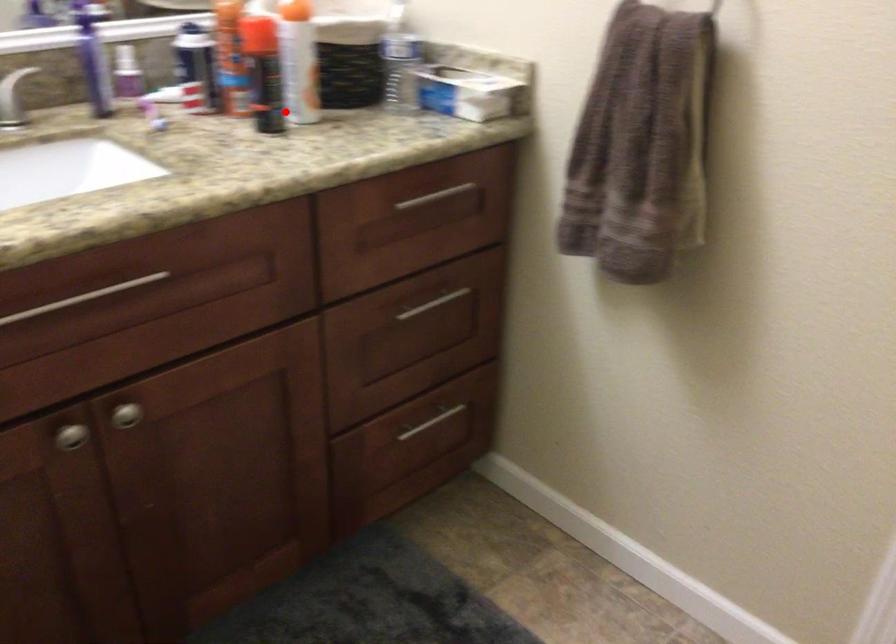
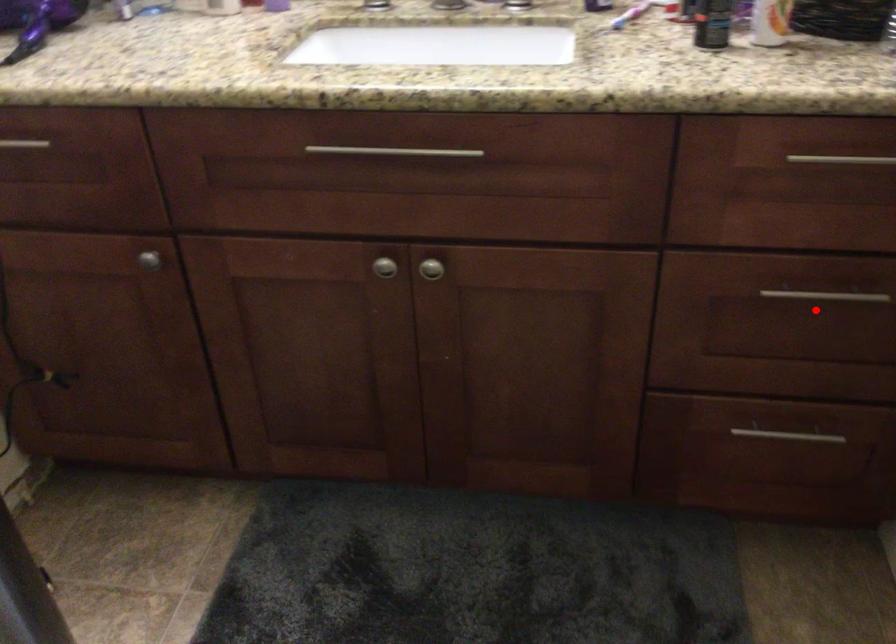
I am providing you with two images of the same scene from different viewpoints. A red point is marked on the first image and another point is marked on the second image. Do the highlighted points in image1 and image2 indicate the same real-world spot?

No